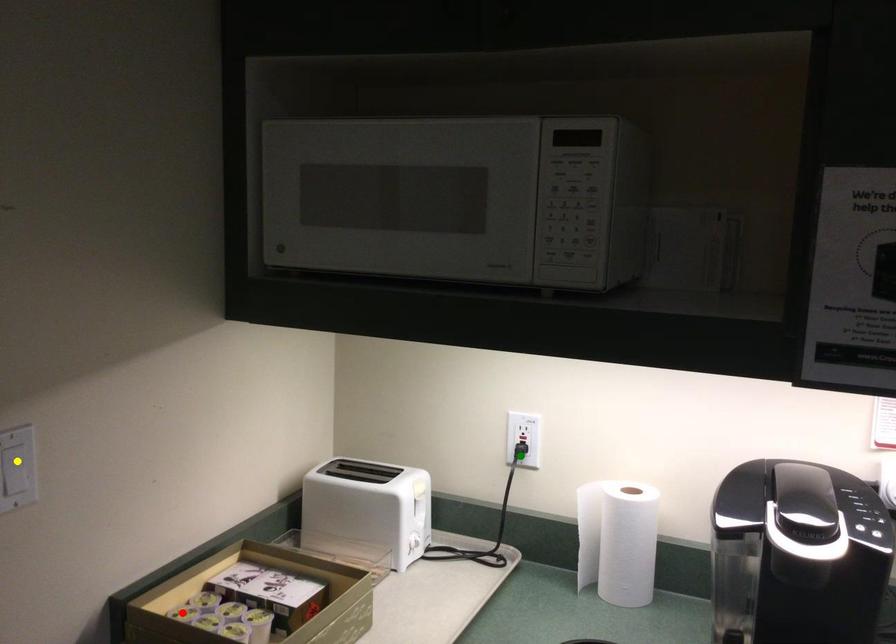
Order these from nearest to farthest:
red point | green point | yellow point

yellow point → red point → green point